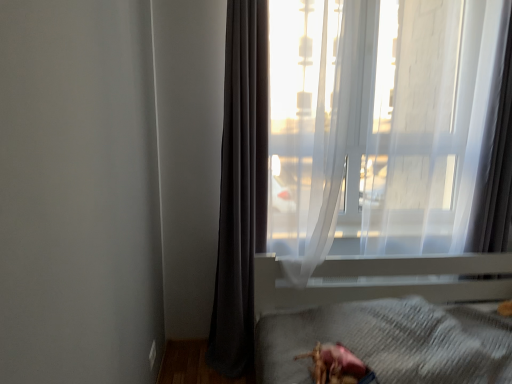
Identify the location of dark gray fabric curtain at left. The height and width of the screenshot is (384, 512). (241, 187).

Consider the image. In order to face dark gray fabric curtain at left, should I rotate leftwards or rightwards?

A 2.612 degree turn to the left will do.

At what (x,y) coordinates should I click in order to perform the action: click on white plastic bed frame at lower right. Please return your answer as a coordinate pair (x, y). This screenshot has width=512, height=384. Looking at the image, I should click on (358, 297).

From the image's perspective, is shiny pink toy at lower center below white plastic bed frame at lower right?

Actually, shiny pink toy at lower center appears above white plastic bed frame at lower right in the image.

Considering the points (331, 383) and (282, 281), which point is in front, point (331, 383) or point (282, 281)?

The point (331, 383) is closer to the camera.

Is shiny pink toy at lower center aimed at white plastic bed frame at lower right?

Yes, shiny pink toy at lower center is facing white plastic bed frame at lower right.

Is the depth of shiny pink toy at lower center less than that of white plastic bed frame at lower right?

No, shiny pink toy at lower center is further to the viewer.

Is white plastic bed frame at lower right to the left of shiny pink toy at lower center from the viewer's perspective?

No.

From the image's perspective, is white plastic bed frame at lower right located above or below shiny pink toy at lower center?

white plastic bed frame at lower right is situated lower than shiny pink toy at lower center in the image.

Does white plastic bed frame at lower right turn towards shiny pink toy at lower center?

Yes, white plastic bed frame at lower right is turned towards shiny pink toy at lower center.

From the picture: From a real-world perspective, is white plastic bed frame at lower right below shiny pink toy at lower center?

Indeed, from a real-world perspective, white plastic bed frame at lower right is positioned beneath shiny pink toy at lower center.

Considering the points (319, 367) and (362, 222), which point is in front, point (319, 367) or point (362, 222)?

The point (319, 367) is in front.

Choose the correct answer: Is shiny pink toy at lower center inside transparent fabric at upper right or outside it?

shiny pink toy at lower center is outside transparent fabric at upper right.

Is shiny pink toy at lower center wider or thinner than transparent fabric at upper right?

Considering their sizes, shiny pink toy at lower center looks broader than transparent fabric at upper right.

Is shiny pink toy at lower center not near transparent fabric at upper right?

Absolutely, shiny pink toy at lower center is distant from transparent fabric at upper right.

From the image's perspective, is shiny pink toy at lower center under dark gray fabric curtain at left?

Indeed, from the image's perspective, shiny pink toy at lower center is shown beneath dark gray fabric curtain at left.

Can you confirm if shiny pink toy at lower center is positioned to the left of dark gray fabric curtain at left?

No.

Looking at their sizes, would you say shiny pink toy at lower center is wider or thinner than dark gray fabric curtain at left?

Considering their sizes, shiny pink toy at lower center looks broader than dark gray fabric curtain at left.

From a real-world perspective, is shiny pink toy at lower center above or below dark gray fabric curtain at left?

Clearly, from a real-world perspective, shiny pink toy at lower center is below dark gray fabric curtain at left.

Considering the relative sizes of dark gray fabric curtain at left and shiny pink toy at lower center in the image provided, is dark gray fabric curtain at left thinner than shiny pink toy at lower center?

Yes, dark gray fabric curtain at left is thinner than shiny pink toy at lower center.

Considering the sizes of objects dark gray fabric curtain at left and shiny pink toy at lower center in the image provided, who is shorter, dark gray fabric curtain at left or shiny pink toy at lower center?

shiny pink toy at lower center is shorter.

From a real-world perspective, is dark gray fabric curtain at left above or below shiny pink toy at lower center?

Clearly, from a real-world perspective, dark gray fabric curtain at left is above shiny pink toy at lower center.

Identify the location of animal in front of the dark gray fabric curtain at left. (337, 365).

Is dark gray fabric curtain at left positioned behind white plastic bed frame at lower right?

Yes, dark gray fabric curtain at left is behind white plastic bed frame at lower right.

Considering the relative sizes of dark gray fabric curtain at left and white plastic bed frame at lower right in the image provided, is dark gray fabric curtain at left taller than white plastic bed frame at lower right?

Correct, dark gray fabric curtain at left is much taller as white plastic bed frame at lower right.

What's the angular difference between dark gray fabric curtain at left and white plastic bed frame at lower right's facing directions?

1.03 degrees separate the facing orientations of dark gray fabric curtain at left and white plastic bed frame at lower right.

From the picture: Between dark gray fabric curtain at left and white plastic bed frame at lower right, which one has smaller size?

dark gray fabric curtain at left.

You are a GUI agent. You are given a task and a screenshot of the screen. Output one action in this format:
    pyautogui.click(x=<x>, y=<y>)
    Task: Click on the animal located below the transparent fabric at upper right (from the image's perspective)
    Image resolution: width=512 pixels, height=384 pixels.
    Given the screenshot: What is the action you would take?
    pyautogui.click(x=337, y=365)

Is point (347, 210) closer or farther from the camera than point (320, 375)?

Point (347, 210) is farther from the camera than point (320, 375).

Is transparent fabric at upper right further to the viewer compared to shiny pink toy at lower center?

Yes, transparent fabric at upper right is further from the camera.

Find the location of `animal located above the white plastic bed frame at lower right (from a real-world perspective)`. animal located above the white plastic bed frame at lower right (from a real-world perspective) is located at coordinates (337, 365).

Locate an element on the screen. bed frame on the right of shiny pink toy at lower center is located at coordinates (358, 297).

Based on their spatial positions, is white plastic bed frame at lower right or dark gray fabric curtain at left further from shiny pink toy at lower center?

dark gray fabric curtain at left is positioned further to the anchor shiny pink toy at lower center.

Looking at the image, which one is located closer to transparent fabric at upper right, dark gray fabric curtain at left or white plastic bed frame at lower right?

dark gray fabric curtain at left.

Estimate the real-world distances between objects in this image. Which object is closer to dark gray fabric curtain at left, shiny pink toy at lower center or transparent fabric at upper right?

Based on the image, transparent fabric at upper right appears to be nearer to dark gray fabric curtain at left.

Estimate the real-world distances between objects in this image. Which object is closer to shiny pink toy at lower center, dark gray fabric curtain at left or white plastic bed frame at lower right?

Based on the image, white plastic bed frame at lower right appears to be nearer to shiny pink toy at lower center.

Considering their positions, is transparent fabric at upper right positioned closer to dark gray fabric curtain at left than shiny pink toy at lower center?

transparent fabric at upper right is positioned closer to the anchor dark gray fabric curtain at left.

When comparing their distances from white plastic bed frame at lower right, does transparent fabric at upper right or dark gray fabric curtain at left seem closer?

Among the two, transparent fabric at upper right is located nearer to white plastic bed frame at lower right.

From the picture: From the image, which object appears to be nearer to transparent fabric at upper right, dark gray fabric curtain at left or shiny pink toy at lower center?

Based on the image, dark gray fabric curtain at left appears to be nearer to transparent fabric at upper right.

When comparing their distances from transparent fabric at upper right, does white plastic bed frame at lower right or shiny pink toy at lower center seem closer?

white plastic bed frame at lower right lies closer to transparent fabric at upper right than the other object.

Find the location of a particular element. The image size is (512, 384). animal between transparent fabric at upper right and white plastic bed frame at lower right vertically is located at coordinates (337, 365).

This screenshot has width=512, height=384. Identify the location of curtain between transparent fabric at upper right and shiny pink toy at lower center in the up-down direction. (241, 187).

Locate an element on the screen. The height and width of the screenshot is (384, 512). curtain that lies between transparent fabric at upper right and white plastic bed frame at lower right from top to bottom is located at coordinates (241, 187).

The width and height of the screenshot is (512, 384). I want to click on animal between dark gray fabric curtain at left and white plastic bed frame at lower right from left to right, so click(337, 365).